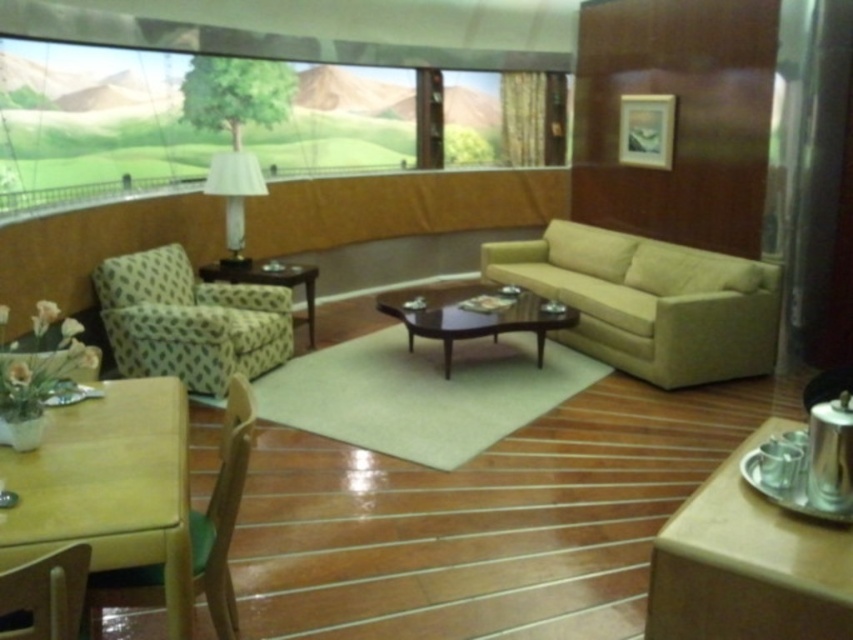
Question: Is the position of yellow matte table at lower left less distant than that of silver metallic tray at lower right?

Choices:
 (A) no
 (B) yes

Answer: (A)

Question: Based on their relative distances, which object is nearer to the green fabric armchair at left?

Choices:
 (A) wooden glossy side table at center
 (B) dark wood/finish coffee table at center
 (C) matte green fabric chair at lower left

Answer: (A)

Question: Does dark wood/finish coffee table at center appear over white fabric lampshade at upper center?

Choices:
 (A) yes
 (B) no

Answer: (B)

Question: Which object appears farthest from the camera in this image?

Choices:
 (A) light brown wood armchair at lower left
 (B) green fabric armchair at left
 (C) white fabric lampshade at upper center
 (D) dark wood/finish coffee table at center

Answer: (C)

Question: Does dark wood/finish coffee table at center appear on the left side of white fabric lampshade at upper center?

Choices:
 (A) yes
 (B) no

Answer: (B)

Question: Which of the following is the closest to the observer?

Choices:
 (A) green fabric armchair at left
 (B) yellow matte table at lower left
 (C) beige fabric couch at center
 (D) light brown wood armchair at lower left

Answer: (B)